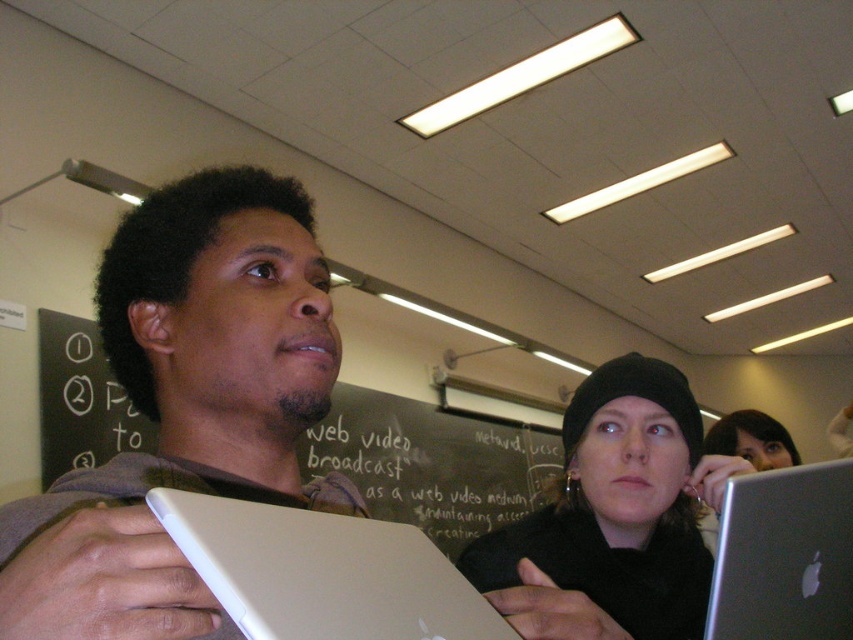
Who is positioned more to the right, black chalkboard at upper left or silver metallic tablet at center?

From the viewer's perspective, black chalkboard at upper left appears more on the right side.

Consider the image. Which is below, black chalkboard at upper left or silver metallic tablet at center?

Positioned lower is black chalkboard at upper left.

Find the location of a particular element. This screenshot has height=640, width=853. black chalkboard at upper left is located at coordinates (432, 461).

In the scene shown: Measure the distance from black chalkboard at center to silver metallic laptop at lower right.

black chalkboard at center is 2.95 meters away from silver metallic laptop at lower right.

Can you confirm if black chalkboard at center is positioned above silver metallic laptop at lower right?

No.

Between point (419, 506) and point (821, 611), which one is positioned in front?

Point (821, 611) is in front.

Locate an element on the screen. black chalkboard at center is located at coordinates (431, 464).

Is point (100, 512) farther from camera compared to point (397, 468)?

No, it is in front of (397, 468).

Is white matte tablet at center behind black chalkboard at center?

No, white matte tablet at center is closer to the viewer.

Locate an element on the screen. white matte tablet at center is located at coordinates [x=184, y=406].